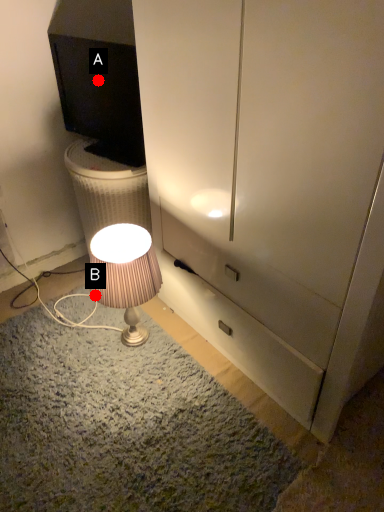
Question: Two points are circled on the image, labeled by A and B beside each circle. Which point is farther to the camera?

Choices:
 (A) A is further
 (B) B is further

Answer: (A)